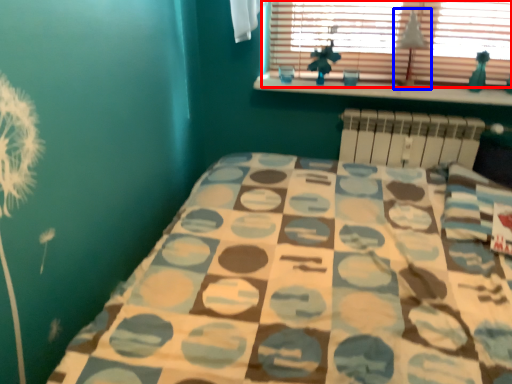
Question: Which point is closer to the camera, window (highlighted by a red box) or lamp (highlighted by a blue box)?

Choices:
 (A) window
 (B) lamp

Answer: (A)